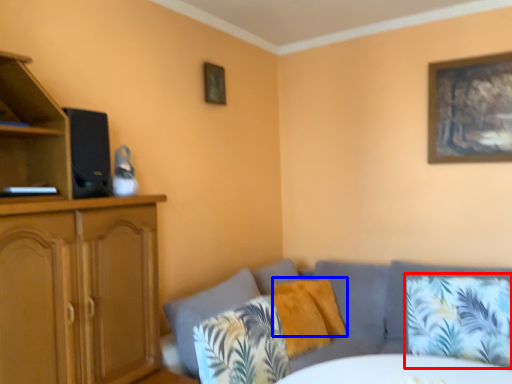
Question: Which point is further to the camera, pillow (highlighted by a red box) or pillow (highlighted by a blue box)?

Choices:
 (A) pillow
 (B) pillow

Answer: (B)